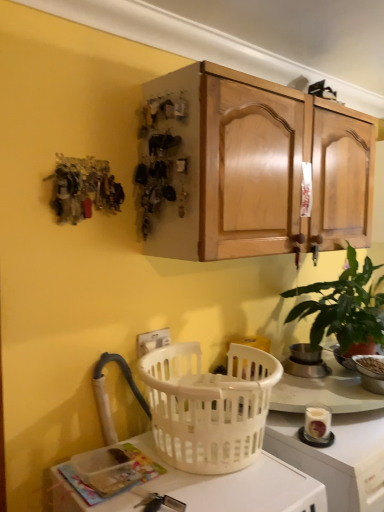
In order to face white plastic basket at lower center, should I rotate leftwards or rightwards?

You should look left and rotate roughly 0.526 degrees.

This screenshot has height=512, width=384. In order to click on white plastic bowl at lower right, the second appliance positioned from the left in this screenshot , I will do `click(371, 372)`.

Image resolution: width=384 pixels, height=512 pixels. What do you see at coordinates (208, 406) in the screenshot?
I see `white plastic picnic basket at lower center` at bounding box center [208, 406].

Where is `metallic silver pot at upper right, positioned as the first appliance in left-to-right order`? This screenshot has height=512, width=384. metallic silver pot at upper right, positioned as the first appliance in left-to-right order is located at coordinates (305, 362).

Image resolution: width=384 pixels, height=512 pixels. Describe the element at coordinates (305, 362) in the screenshot. I see `metallic silver pot at upper right, which appears as the second appliance when viewed from the right` at that location.

You are a GUI agent. You are given a task and a screenshot of the screen. Output one action in this format:
    pyautogui.click(x=<x>, y=<y>)
    Task: Click on the white plastic basket at lower center
    
    Given the screenshot: What is the action you would take?
    pyautogui.click(x=238, y=485)

Image resolution: width=384 pixels, height=512 pixels. Find the location of `electric outlet that is above the white plastic bowl at lower right, positioned as the 1th appliance in right-to-left order (from a real-world perspective)`. electric outlet that is above the white plastic bowl at lower right, positioned as the 1th appliance in right-to-left order (from a real-world perspective) is located at coordinates (152, 341).

Looking at this image, based on their positions, is white plastic electric outlet at lower center located to the left or right of white plastic bowl at lower right, the second appliance positioned from the left?

From the image, it's evident that white plastic electric outlet at lower center is to the left of white plastic bowl at lower right, the second appliance positioned from the left.

Which of these two, white plastic electric outlet at lower center or white plastic bowl at lower right, positioned as the 1th appliance in right-to-left order, is thinner?

white plastic electric outlet at lower center is thinner.

Considering the positions of objects metallic silver pot at upper right, which appears as the second appliance when viewed from the right, and white plastic electric outlet at lower center in the image provided, who is behind, metallic silver pot at upper right, which appears as the second appliance when viewed from the right, or white plastic electric outlet at lower center?

metallic silver pot at upper right, which appears as the second appliance when viewed from the right, is further from the camera.

What's the angular difference between metallic silver pot at upper right, positioned as the first appliance in left-to-right order, and white plastic electric outlet at lower center's facing directions?

The facing directions of metallic silver pot at upper right, positioned as the first appliance in left-to-right order, and white plastic electric outlet at lower center are 1.13 degrees apart.

Can white plastic electric outlet at lower center be found inside metallic silver pot at upper right, positioned as the first appliance in left-to-right order?

No, metallic silver pot at upper right, positioned as the first appliance in left-to-right order, does not contain white plastic electric outlet at lower center.

Between metallic silver pot at upper right, positioned as the first appliance in left-to-right order, and white plastic electric outlet at lower center, which one has smaller size?

white plastic electric outlet at lower center is smaller.

From the picture: Does white plastic picnic basket at lower center turn towards green matte plant at right?

No, white plastic picnic basket at lower center does not turn towards green matte plant at right.

Considering the sizes of objects white plastic picnic basket at lower center and green matte plant at right in the image provided, who is thinner, white plastic picnic basket at lower center or green matte plant at right?

white plastic picnic basket at lower center.

Is white plastic picnic basket at lower center far away from green matte plant at right?

No.

From the image's perspective, would you say white plastic picnic basket at lower center is shown under green matte plant at right?

Yes, from the image's perspective, white plastic picnic basket at lower center is below green matte plant at right.

Can you confirm if white plastic electric outlet at lower center is thinner than white plastic basket at lower center?

Yes, white plastic electric outlet at lower center is thinner than white plastic basket at lower center.

From the image's perspective, is white plastic electric outlet at lower center over white plastic basket at lower center?

Indeed, from the image's perspective, white plastic electric outlet at lower center is shown above white plastic basket at lower center.

Identify the location of electric outlet that appears behind the white plastic basket at lower center. This screenshot has height=512, width=384. (152, 341).

Looking at this image, are white plastic electric outlet at lower center and white plastic basket at lower center located far from each other?

Actually, white plastic electric outlet at lower center and white plastic basket at lower center are a little close together.

Can you confirm if white plastic bowl at lower right, the second appliance positioned from the left, is smaller than white plastic electric outlet at lower center?

No, white plastic bowl at lower right, the second appliance positioned from the left, is not smaller than white plastic electric outlet at lower center.

Does white plastic bowl at lower right, the second appliance positioned from the left, come behind white plastic electric outlet at lower center?

Yes, white plastic bowl at lower right, the second appliance positioned from the left, is further from the viewer.

Looking at this image, what's the angular difference between white plastic bowl at lower right, the second appliance positioned from the left, and white plastic electric outlet at lower center's facing directions?

There is a 19.2-degree angle between the facing directions of white plastic bowl at lower right, the second appliance positioned from the left, and white plastic electric outlet at lower center.

Which is correct: white plastic bowl at lower right, positioned as the 1th appliance in right-to-left order, is inside white plastic electric outlet at lower center, or outside of it?

white plastic bowl at lower right, positioned as the 1th appliance in right-to-left order, is located beyond the bounds of white plastic electric outlet at lower center.

From the image's perspective, is white plastic bowl at lower right, positioned as the 1th appliance in right-to-left order, over metallic silver pot at upper right, positioned as the first appliance in left-to-right order?

Incorrect, from the image's perspective, white plastic bowl at lower right, positioned as the 1th appliance in right-to-left order, is lower than metallic silver pot at upper right, positioned as the first appliance in left-to-right order.

Considering the positions of objects white plastic bowl at lower right, the second appliance positioned from the left, and metallic silver pot at upper right, positioned as the first appliance in left-to-right order, in the image provided, who is in front, white plastic bowl at lower right, the second appliance positioned from the left, or metallic silver pot at upper right, positioned as the first appliance in left-to-right order,?

white plastic bowl at lower right, the second appliance positioned from the left, is closer to the camera.

From a real-world perspective, is white plastic bowl at lower right, positioned as the 1th appliance in right-to-left order, physically located above or below metallic silver pot at upper right, which appears as the second appliance when viewed from the right?

From a real-world perspective, white plastic bowl at lower right, positioned as the 1th appliance in right-to-left order, is physically below metallic silver pot at upper right, which appears as the second appliance when viewed from the right.

Looking at their sizes, would you say green matte plant at right is wider or thinner than white plastic bowl at lower right, the second appliance positioned from the left?

Considering their sizes, green matte plant at right looks broader than white plastic bowl at lower right, the second appliance positioned from the left.

Is white plastic bowl at lower right, positioned as the 1th appliance in right-to-left order, located within green matte plant at right?

Indeed, white plastic bowl at lower right, positioned as the 1th appliance in right-to-left order, is located within green matte plant at right.

What's the angular difference between green matte plant at right and white plastic bowl at lower right, positioned as the 1th appliance in right-to-left order,'s facing directions?

The facing directions of green matte plant at right and white plastic bowl at lower right, positioned as the 1th appliance in right-to-left order, are 20.3 degrees apart.

At what (x,y) coordinates should I click in order to perform the action: click on electric outlet above the white plastic bowl at lower right, positioned as the 1th appliance in right-to-left order (from a real-world perspective). Please return your answer as a coordinate pair (x, y). The image size is (384, 512). Looking at the image, I should click on coord(152,341).

I want to click on the 1st appliance below the white plastic electric outlet at lower center (from the image's perspective), so click(x=305, y=362).

Based on their spatial positions, is metallic silver pot at upper right, positioned as the first appliance in left-to-right order, or white plastic picnic basket at lower center closer to white plastic basket at lower center?

white plastic picnic basket at lower center is positioned closer to the anchor white plastic basket at lower center.

Based on their spatial positions, is metallic silver pot at upper right, positioned as the first appliance in left-to-right order, or white plastic electric outlet at lower center closer to white plastic basket at lower center?

Based on the image, white plastic electric outlet at lower center appears to be nearer to white plastic basket at lower center.

Estimate the real-world distances between objects in this image. Which object is further from white plastic basket at lower center, white plastic picnic basket at lower center or white plastic electric outlet at lower center?

white plastic electric outlet at lower center.

Considering their positions, is white plastic bowl at lower right, the second appliance positioned from the left, positioned further to metallic silver pot at upper right, positioned as the first appliance in left-to-right order, than white plastic basket at lower center?

white plastic basket at lower center is positioned further to the anchor metallic silver pot at upper right, positioned as the first appliance in left-to-right order.

Considering their positions, is white plastic basket at lower center positioned further to white plastic electric outlet at lower center than green matte plant at right?

green matte plant at right lies further to white plastic electric outlet at lower center than the other object.

Based on their spatial positions, is metallic silver pot at upper right, positioned as the first appliance in left-to-right order, or white plastic electric outlet at lower center closer to white plastic picnic basket at lower center?

white plastic electric outlet at lower center lies closer to white plastic picnic basket at lower center than the other object.

When comparing their distances from white plastic bowl at lower right, positioned as the 1th appliance in right-to-left order, does white plastic electric outlet at lower center or white plastic basket at lower center seem further?

white plastic electric outlet at lower center is further to white plastic bowl at lower right, positioned as the 1th appliance in right-to-left order.

When comparing their distances from white plastic bowl at lower right, the second appliance positioned from the left, does metallic silver pot at upper right, positioned as the first appliance in left-to-right order, or white plastic picnic basket at lower center seem closer?

metallic silver pot at upper right, positioned as the first appliance in left-to-right order.

Find the location of a particular element. appliance between white plastic electric outlet at lower center and white plastic bowl at lower right, the second appliance positioned from the left, from left to right is located at coordinates (305, 362).

You are a GUI agent. You are given a task and a screenshot of the screen. Output one action in this format:
    pyautogui.click(x=<x>, y=<y>)
    Task: Click on the appliance located between white plastic picnic basket at lower center and metallic silver pot at upper right, positioned as the first appliance in left-to-right order, in the depth direction
    
    Given the screenshot: What is the action you would take?
    pyautogui.click(x=371, y=372)

The image size is (384, 512). I want to click on houseplant between white plastic electric outlet at lower center and white plastic bowl at lower right, positioned as the 1th appliance in right-to-left order, in the horizontal direction, so click(344, 308).

Where is `houseplant between white plastic basket at lower center and metallic silver pot at upper right, positioned as the first appliance in left-to-right order, along the z-axis`? houseplant between white plastic basket at lower center and metallic silver pot at upper right, positioned as the first appliance in left-to-right order, along the z-axis is located at coordinates (344, 308).